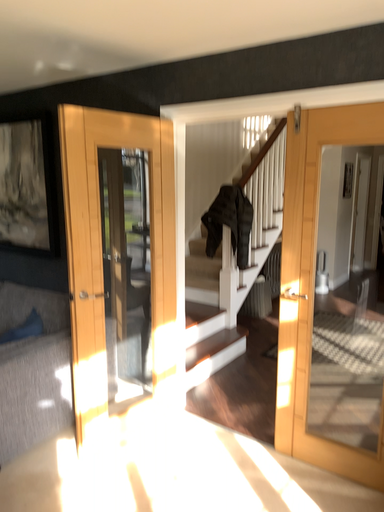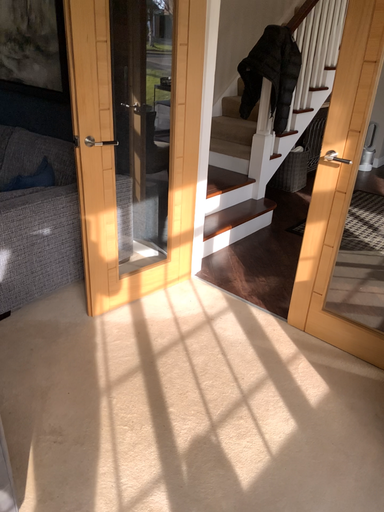
Question: How did the camera likely rotate when shooting the video?

Choices:
 (A) rotated upward
 (B) rotated downward

Answer: (B)